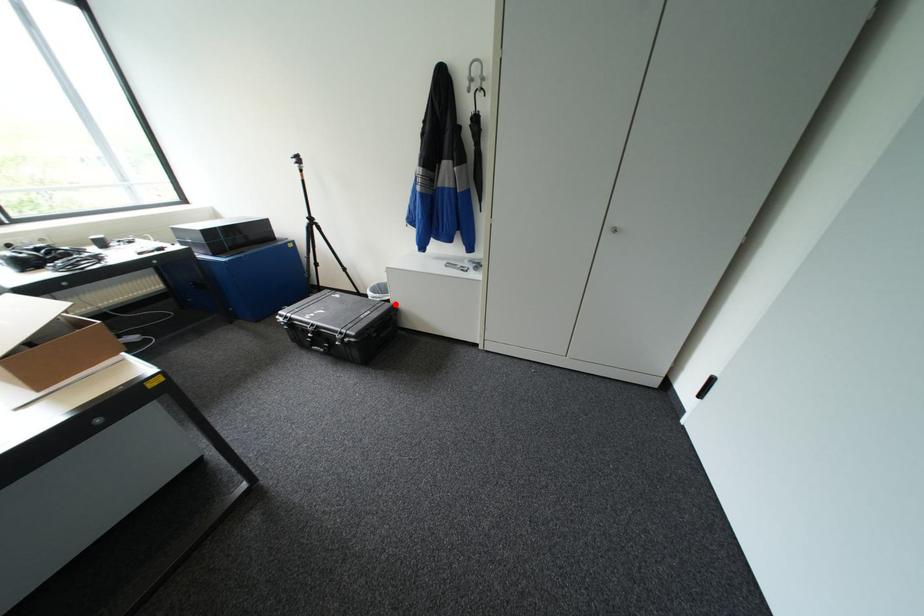
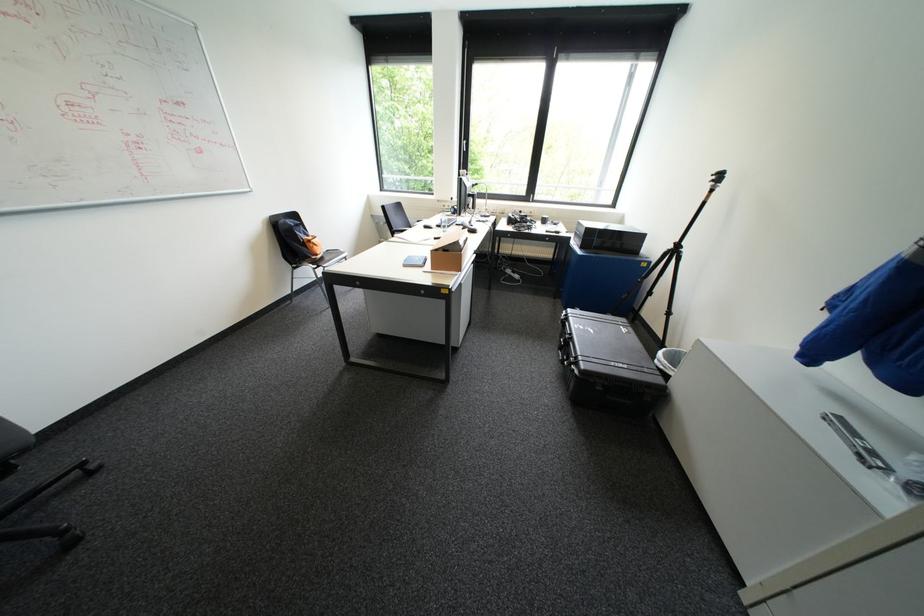
Where in the second image is the point corresponding to the highlighted location from the first image?

(666, 379)